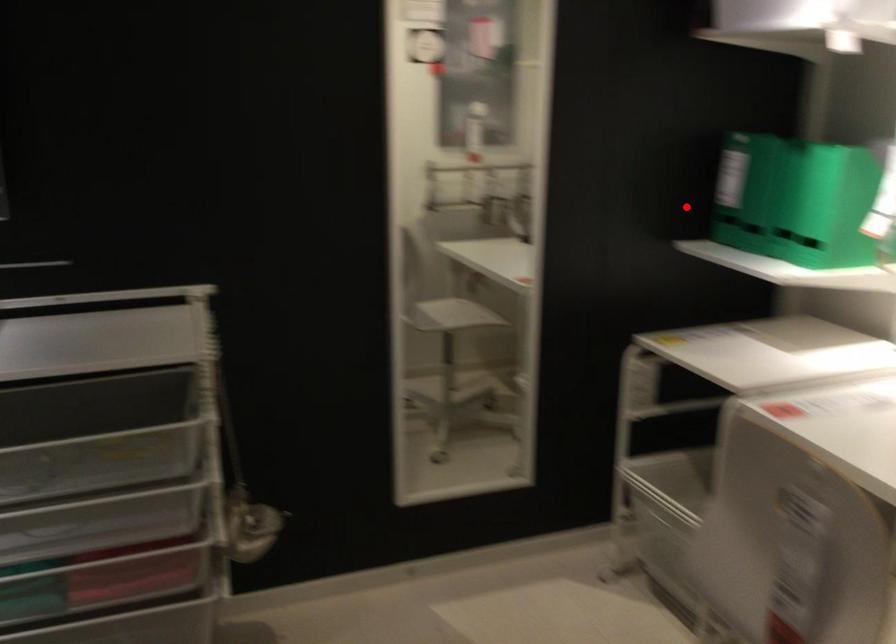
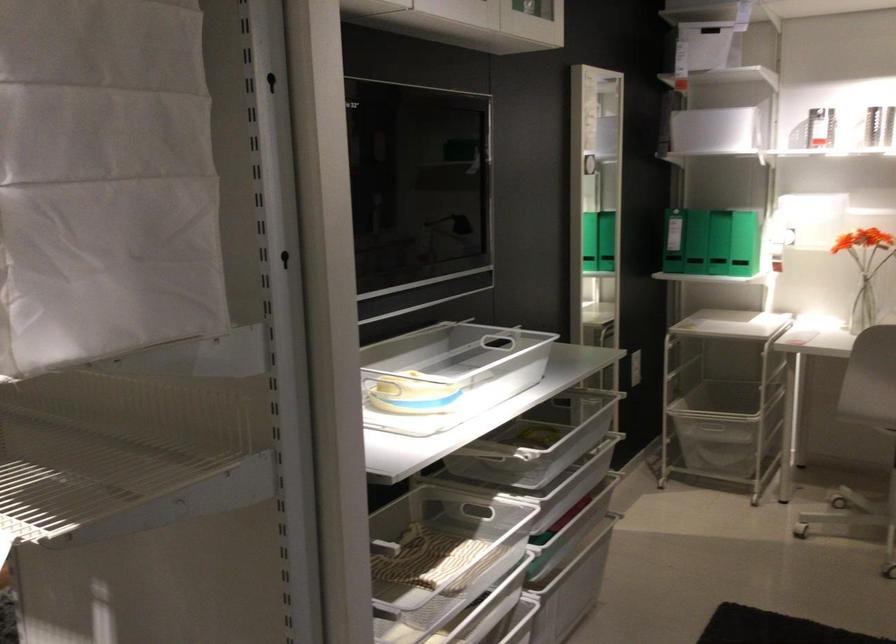
Question: I am providing you with two images of the same scene from different viewpoints. A red point is shown in image1. For the corresponding object point in image2, is it positioned nearer or farther from the camera?

Choices:
 (A) Nearer
 (B) Farther

Answer: (B)